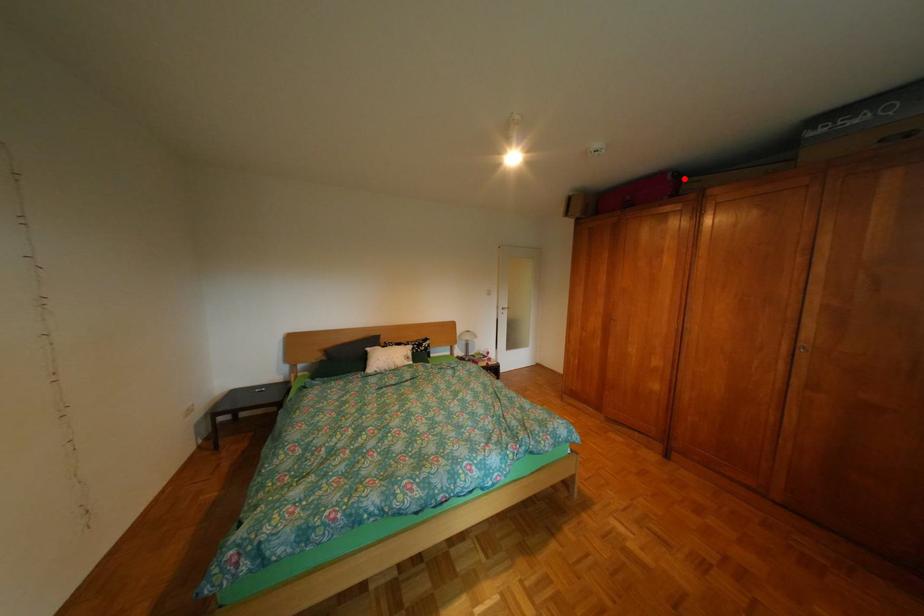
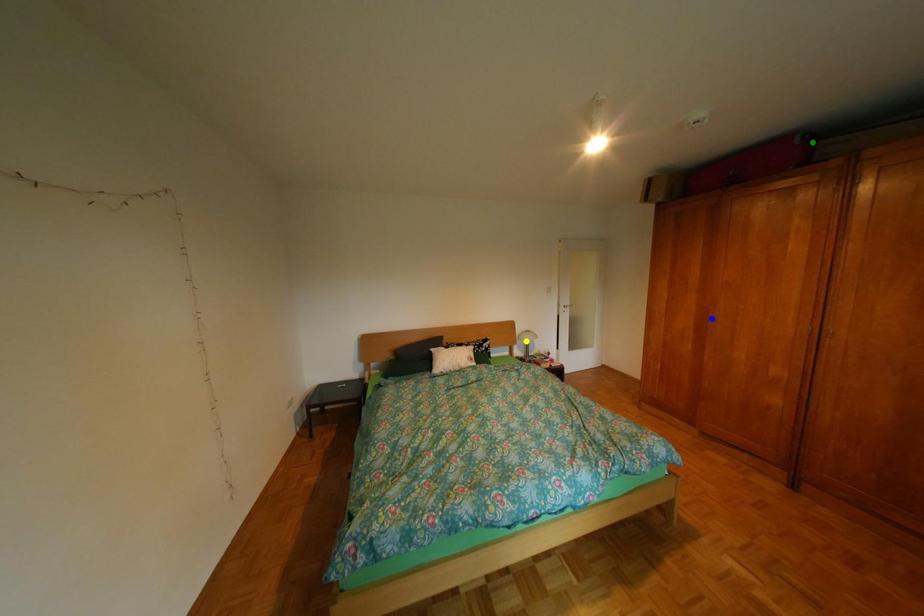
Question: I am providing you with two images of the same scene from different viewpoints. A red point is marked on the first image. You are given multiple points on the second image. Which mark in image 2 goes with the point in image 1?

Choices:
 (A) blue point
 (B) yellow point
 (C) green point

Answer: (C)